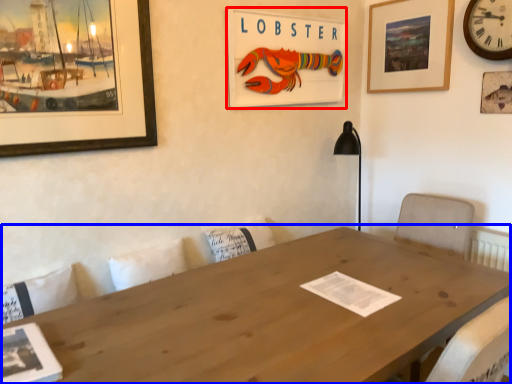
Question: Which of the following is the closest to the observer, picture frame (highlighted by a red box) or table (highlighted by a blue box)?

Choices:
 (A) picture frame
 (B) table

Answer: (B)